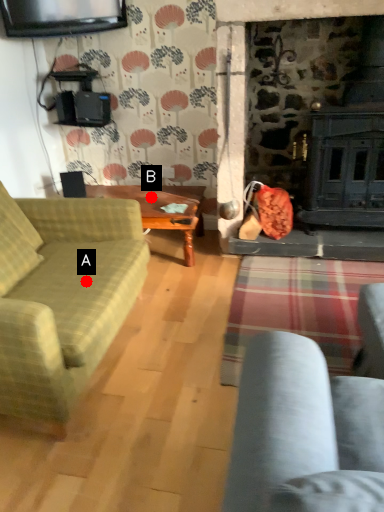
Question: Two points are circled on the image, labeled by A and B beside each circle. Which point appears farthest from the camera in this image?

Choices:
 (A) A is further
 (B) B is further

Answer: (B)